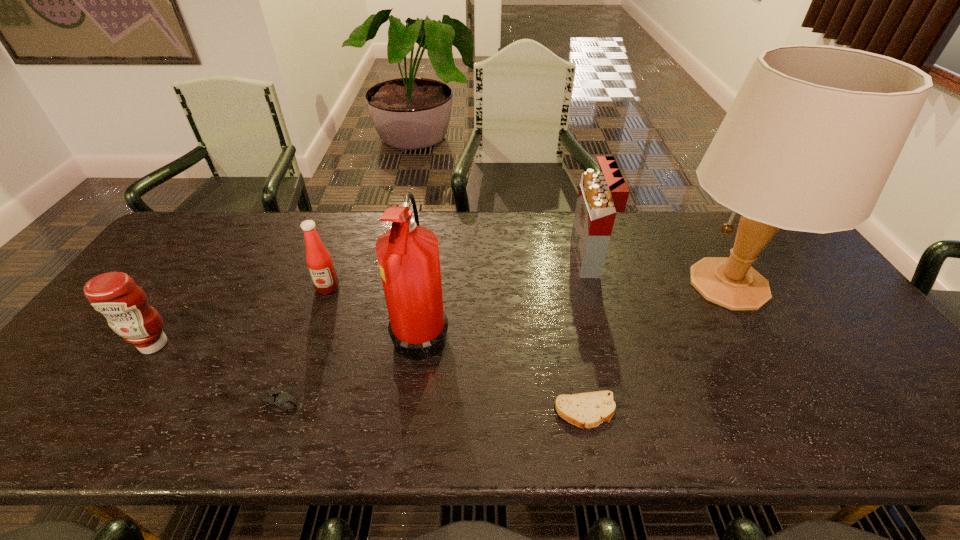
The height and width of the screenshot is (540, 960). Identify the location of cigarette case that is at the far edge. (601, 195).

This screenshot has height=540, width=960. I want to click on computer mouse that is at the near edge, so click(x=280, y=401).

What are the coordinates of `pita bread at the near edge` in the screenshot? It's located at (587, 410).

Identify the location of object that is at the left edge. (124, 304).

Image resolution: width=960 pixels, height=540 pixels. Identify the location of object situated at the right edge. (810, 140).

Where is `object present at the far right corner`? object present at the far right corner is located at coordinates (810, 140).

Identify the location of vacant space at the far edge of the desktop. (264, 252).

The image size is (960, 540). Find the location of `vacant space at the near edge`. vacant space at the near edge is located at coordinates (320, 441).

This screenshot has height=540, width=960. I want to click on free space at the left edge, so click(193, 275).

At what (x,y) coordinates should I click in order to perform the action: click on vacant space at the right edge. Please return your answer as a coordinate pair (x, y). Image resolution: width=960 pixels, height=540 pixels. Looking at the image, I should click on (837, 349).